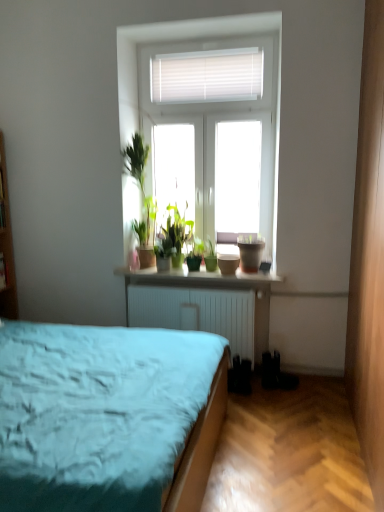
Question: From the image's perspective, is green matte plant at center, the 1th houseplant when ordered from left to right, located above or below matte ceramic pots at center?

Choices:
 (A) below
 (B) above

Answer: (B)

Question: Is green matte plant at center, the 1th houseplant when ordered from left to right, inside or outside of matte ceramic pots at center?

Choices:
 (A) outside
 (B) inside

Answer: (A)

Question: Estimate the real-world distances between objects in this image. Which object is farther from the matte ceramic pots at center?

Choices:
 (A) green matte plant at center, which appears as the second houseplant when viewed from the left
 (B) green matte plant at center, acting as the second houseplant starting from the right
 (C) matte brown flowerpot at window

Answer: (C)

Question: Estimate the real-world distances between objects in this image. Which object is farther from the green matte plant at center, marked as the 1th houseplant in a right-to-left arrangement?

Choices:
 (A) green matte plant at center, the 1th houseplant when ordered from left to right
 (B) matte brown flowerpot at window
 (C) matte ceramic pots at center

Answer: (B)